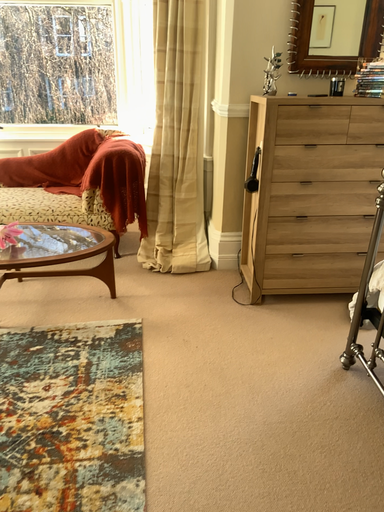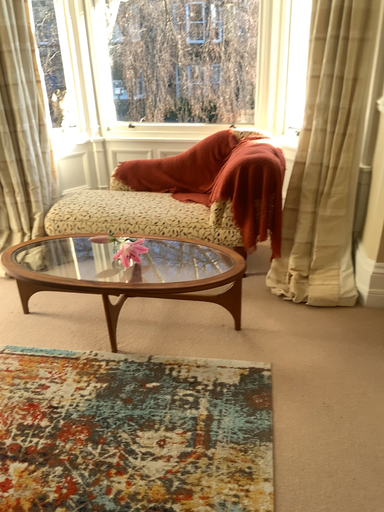
Question: How did the camera likely rotate when shooting the video?

Choices:
 (A) rotated right
 (B) rotated left

Answer: (B)